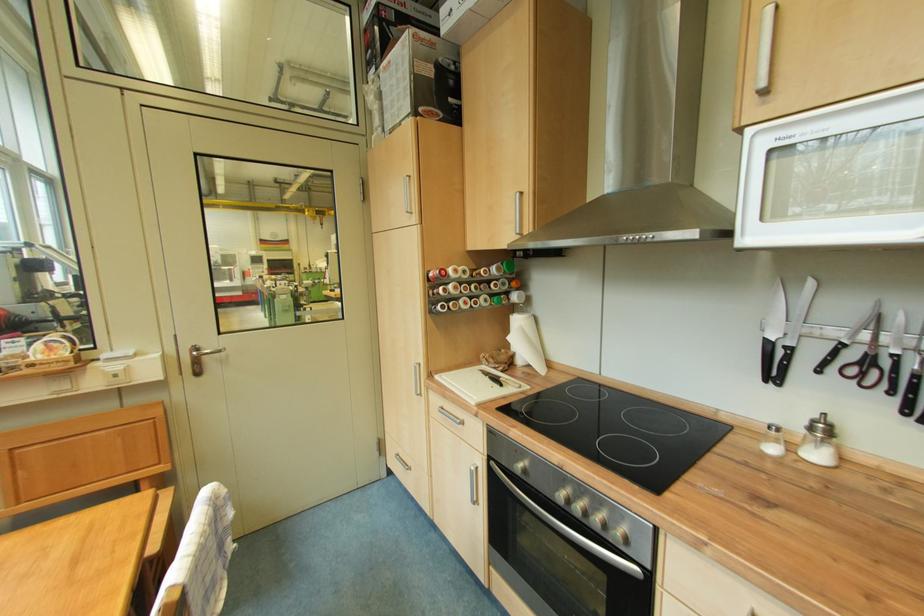
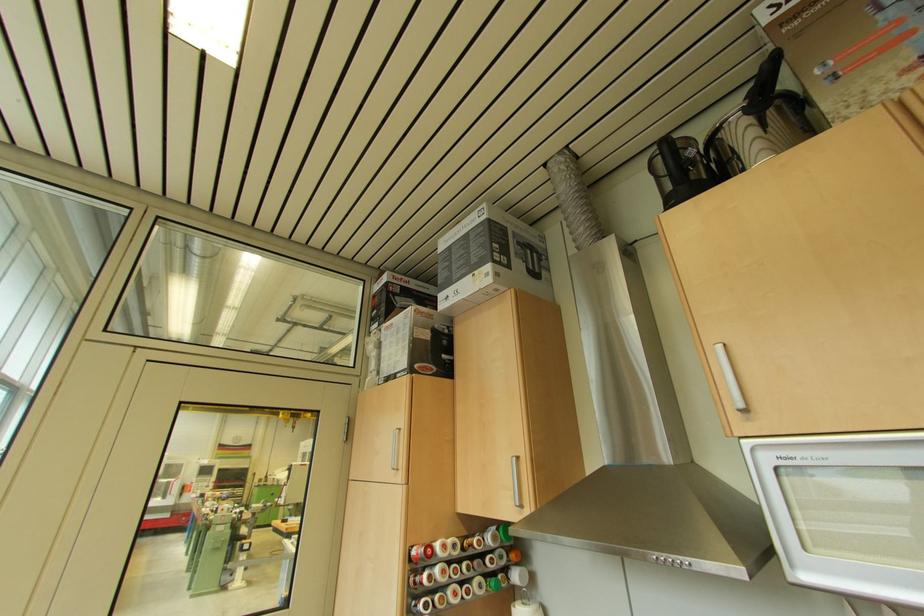
Find the pixel in the second image that matches (521,228) in the first image.

(519, 496)